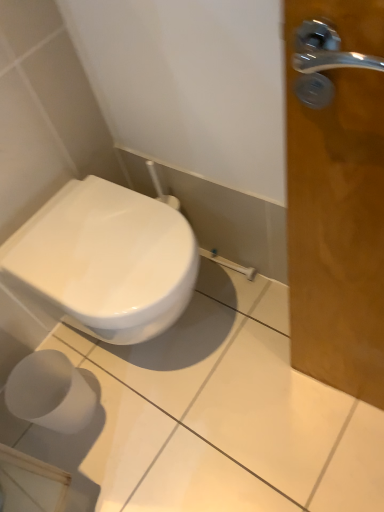
Question: Is white matte toilet paper at lower left bigger or smaller than white glossy toilet at lower left?

Choices:
 (A) small
 (B) big

Answer: (A)

Question: From a real-world perspective, is white matte toilet paper at lower left above or below white glossy toilet at lower left?

Choices:
 (A) above
 (B) below

Answer: (B)

Question: From the image's perspective, is white matte toilet paper at lower left positioned above or below white glossy toilet at lower left?

Choices:
 (A) below
 (B) above

Answer: (A)

Question: Does point (89, 291) appear closer or farther from the camera than point (77, 404)?

Choices:
 (A) farther
 (B) closer

Answer: (B)

Question: From a real-world perspective, is white glossy toilet at lower left positioned above or below white matte toilet paper at lower left?

Choices:
 (A) above
 (B) below

Answer: (A)

Question: From the image's perspective, relative to white matte toilet paper at lower left, is white glossy toilet at lower left above or below?

Choices:
 (A) above
 (B) below

Answer: (A)

Question: Do you think white glossy toilet at lower left is within white matte toilet paper at lower left, or outside of it?

Choices:
 (A) outside
 (B) inside

Answer: (A)